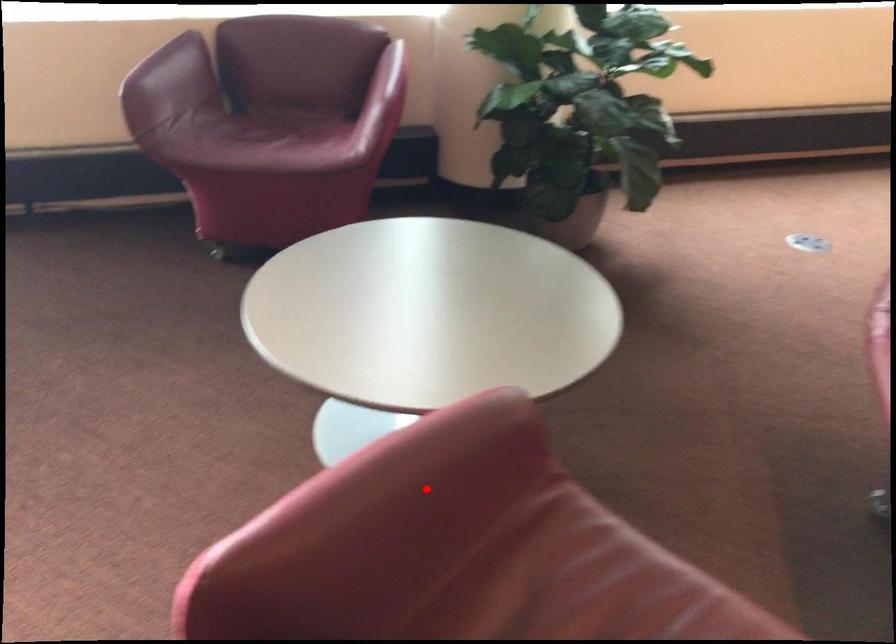
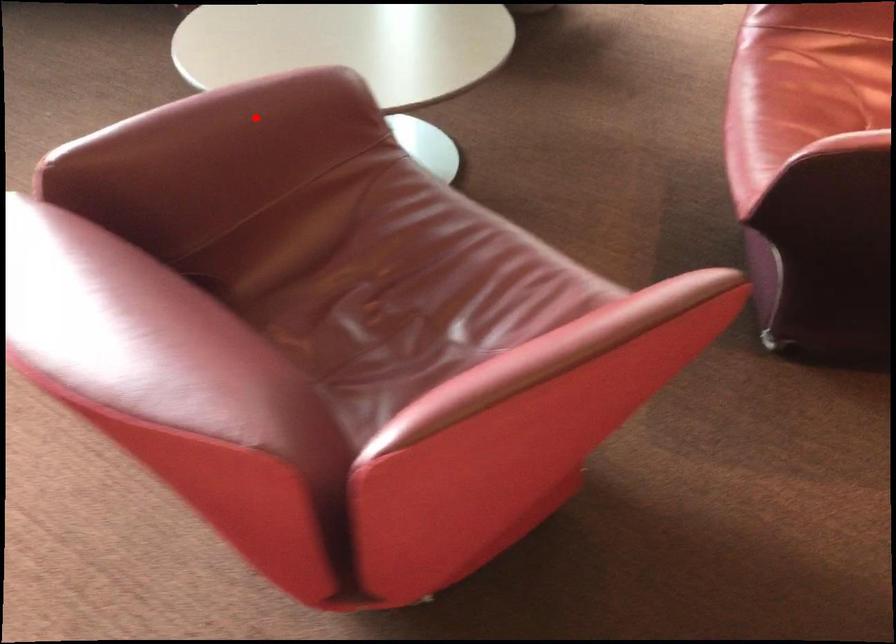
Based on the photo, I am providing you with two images of the same scene from different viewpoints. A red point is marked on the first image and another point is marked on the second image. Are the points marked in image1 and image2 representing the same 3D position?

Yes